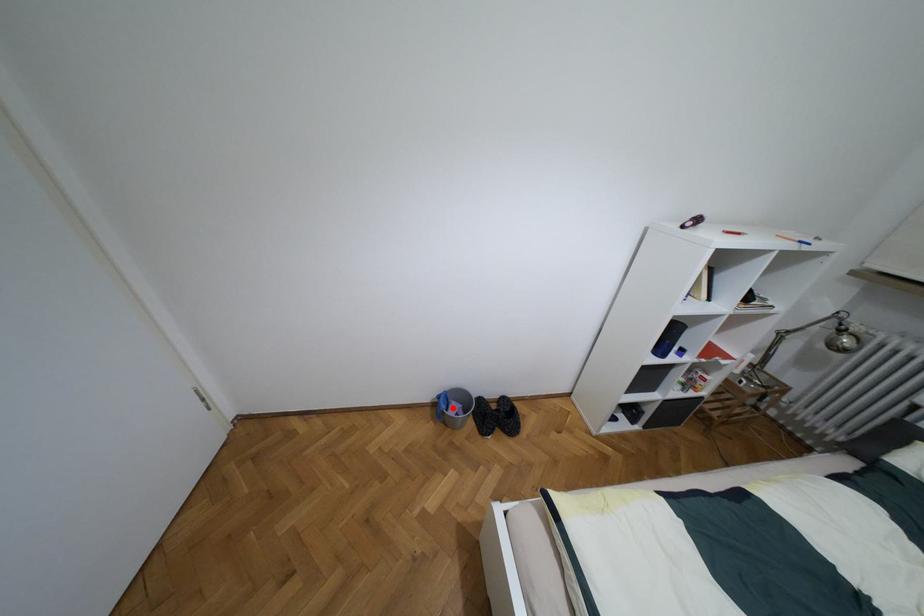
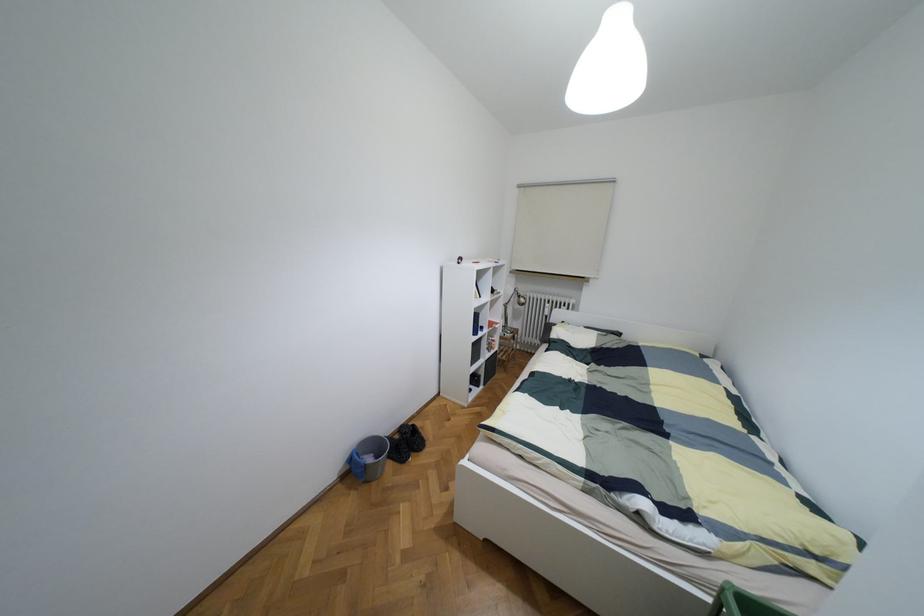
Question: I am providing you with two images of the same scene from different viewpoints. A red point is shown in image1. For the corresponding object point in image2, is it positioned nearer or farther from the camera?

Choices:
 (A) Nearer
 (B) Farther

Answer: (A)